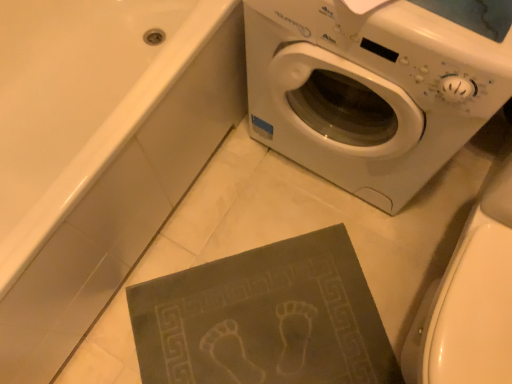
In order to click on vacant area situated below dark gray textured mat at lower center (from a real-world perspective) in this screenshot , I will do `click(255, 324)`.